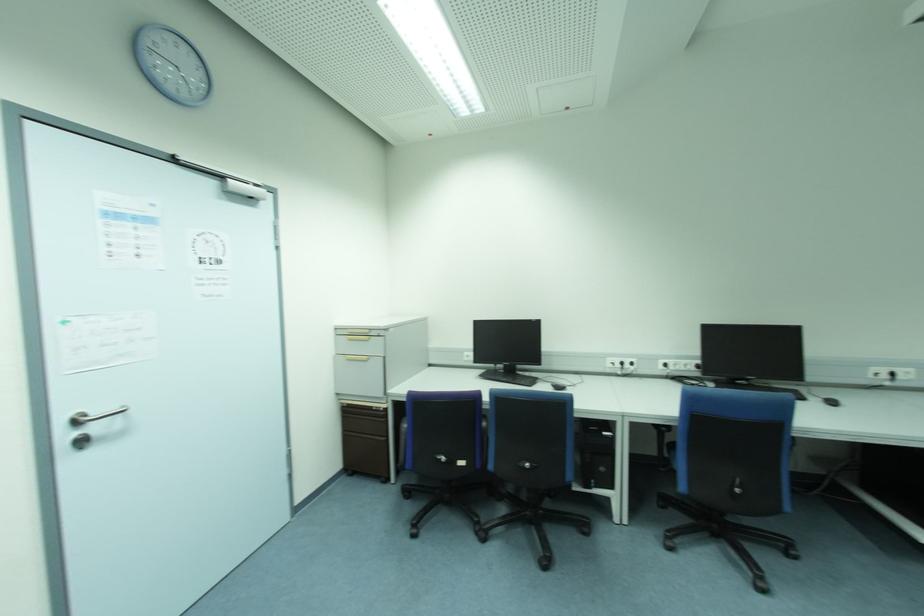
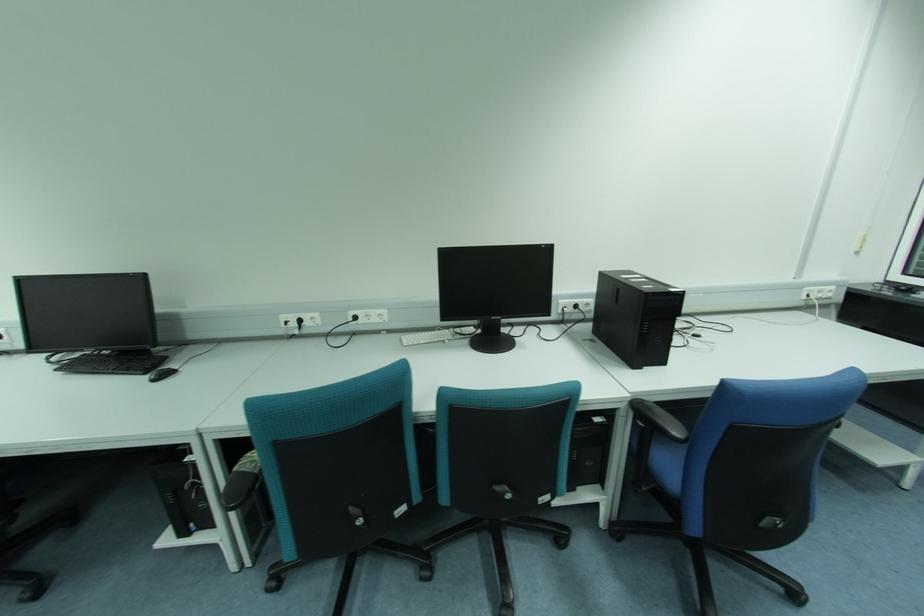
Question: What movement of the cameraman would produce the second image?

Choices:
 (A) Left
 (B) Right
 (C) Forward
 (D) Backward

Answer: (B)